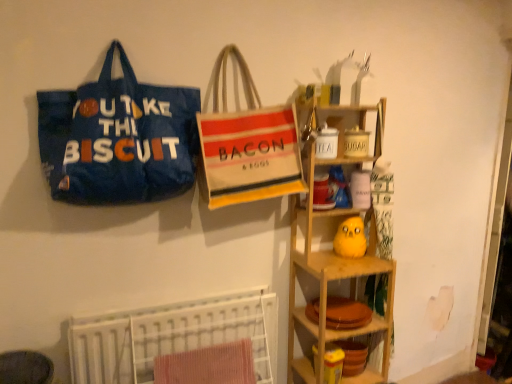
Question: Is white textured bed at lower left taller or shorter than beige canvas tote bag at center, acting as the 1th handbag starting from the right?

Choices:
 (A) tall
 (B) short

Answer: (B)

Question: Choose the correct answer: Is white textured bed at lower left inside beige canvas tote bag at center, positioned as the second handbag in left-to-right order, or outside it?

Choices:
 (A) outside
 (B) inside

Answer: (A)

Question: Which object is positioned closest to the wooden shelf at right, which is the first shelf from top to bottom?

Choices:
 (A) beige canvas tote bag at center, positioned as the second handbag in left-to-right order
 (B) red textured towel at lower center
 (C) blue fabric tote bag at left, placed as the 1th handbag when sorted from left to right
 (D) wooden plate at lower center, the first shelf when ordered from bottom to top
 (E) white textured bed at lower left

Answer: (D)

Question: Considering the real-world distances, which object is farthest from the red textured towel at lower center?

Choices:
 (A) wooden plate at lower center, the first shelf when ordered from bottom to top
 (B) wooden shelf at right, which is the first shelf from top to bottom
 (C) white textured bed at lower left
 (D) blue fabric tote bag at left, placed as the 1th handbag when sorted from left to right
 (E) beige canvas tote bag at center, positioned as the second handbag in left-to-right order

Answer: (D)